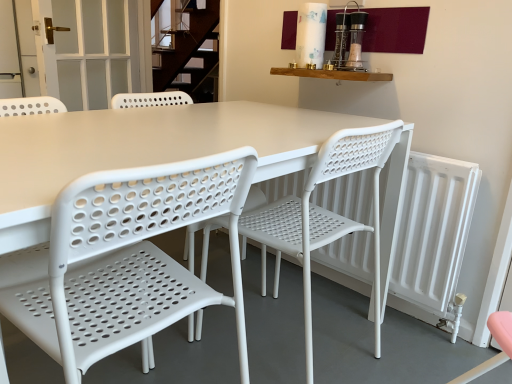
At what (x,y) coordinates should I click in order to perform the action: click on vacant space underneath white matte radiator at right (from a real-world perspective). Please return your answer as a coordinate pair (x, y). Looking at the image, I should click on (368, 304).